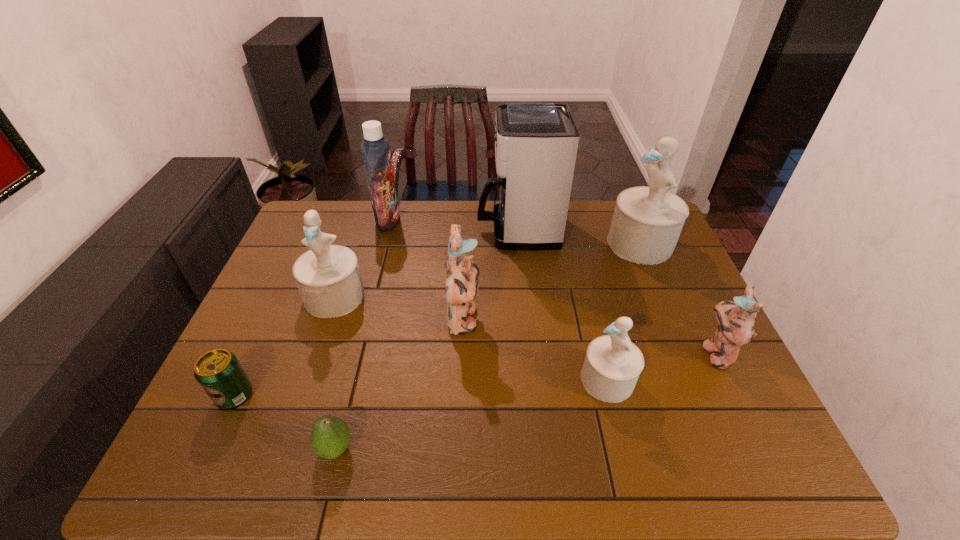
Image resolution: width=960 pixels, height=540 pixels. Identify the location of vacant area that lies between the left pink figurine and the coffee maker. (491, 275).

At what (x,y) coordinates should I click in order to perform the action: click on vacant space in between the leftmost figurine and the tallest figurine. Please return your answer as a coordinate pair (x, y). Looking at the image, I should click on (488, 270).

Select which object is the third closest to the farthest white figurine. Please provide its 2D coordinates. Your answer should be formatted as a tuple, i.e. [(x, y)], where the tuple contains the x and y coordinates of a point satisfying the conditions above.

[(612, 365)]

Where is `object that is the sixth nearest to the leftmost object`? This screenshot has height=540, width=960. object that is the sixth nearest to the leftmost object is located at coordinates (612, 365).

The height and width of the screenshot is (540, 960). In order to click on the third closest figurine relative to the bigger pink figurine in this screenshot , I will do `click(647, 221)`.

The width and height of the screenshot is (960, 540). In order to click on the second closest figurine to the coffee maker in this screenshot , I will do `click(461, 274)`.

Identify the location of white figurine that is the second nearest to the third figurine from right to left. This screenshot has height=540, width=960. pyautogui.click(x=328, y=277).

At what (x,y) coordinates should I click in order to perform the action: click on the second closest white figurine to the tallest figurine. Please return your answer as a coordinate pair (x, y). This screenshot has height=540, width=960. Looking at the image, I should click on (328, 277).

Identify the location of free space that satisfies the following two spatial constraints: 1. at the beak of the third figurine from right to left; 2. on the front side of the nearest object. (625, 449).

Identify the location of free space that satisfies the following two spatial constraints: 1. on the front label of the blue shampoo; 2. at the beak of the leftmost white figurine. (369, 296).